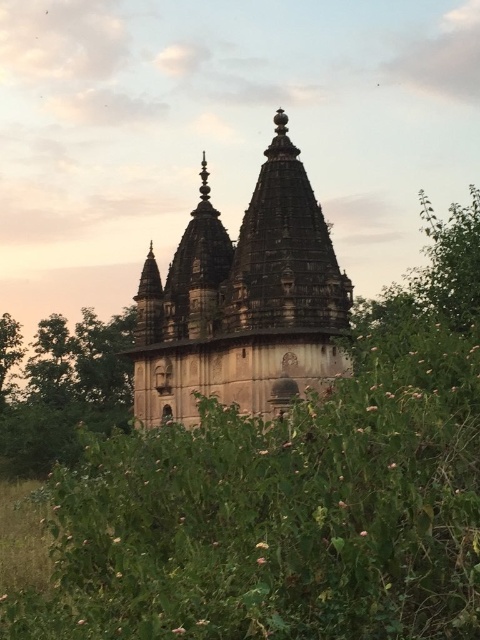
You are standing in front of the stone hindu temple at center and want to take a photo of the green leafy tree at center. Since both are at the center, which one will appear larger in your camera view?

The stone hindu temple at center is closer to the viewer than the green leafy tree at center, so it will appear larger in the photo.

You are a photographer planning to capture the stone hindu temple at center and the green leafy tree at center in a single frame. Based on their sizes, which object should you position closer to the camera to ensure both fit within the frame?

Since the stone hindu temple at center is wider than the green leafy tree at center, positioning the green leafy tree at center closer to the camera would allow both to fit within the frame as the smaller tree can be magnified while the larger temple remains in the background.

You are a tourist standing at a certain distance from the stone hindu temple at center. You want to take a photo that captures the entire temple structure in one frame. Considering the temple is 94.07 meters away, would you need to move closer or farther away to ensure the entire temple fits in your camera view?

The stone hindu temple at center is 94.07 meters away from the camera. To capture the entire temple structure in one frame, you would need to move farther away to ensure the entire temple fits in your camera view.